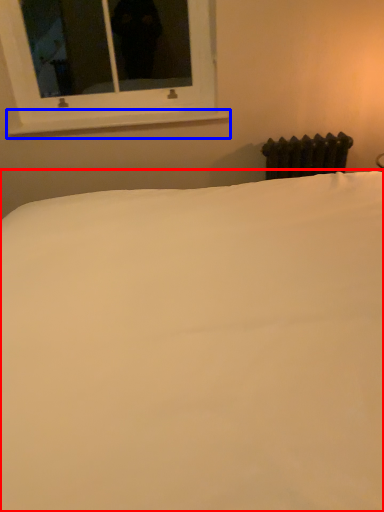
Question: Which of the following is the closest to the observer, bed (highlighted by a red box) or window sill (highlighted by a blue box)?

Choices:
 (A) bed
 (B) window sill

Answer: (A)